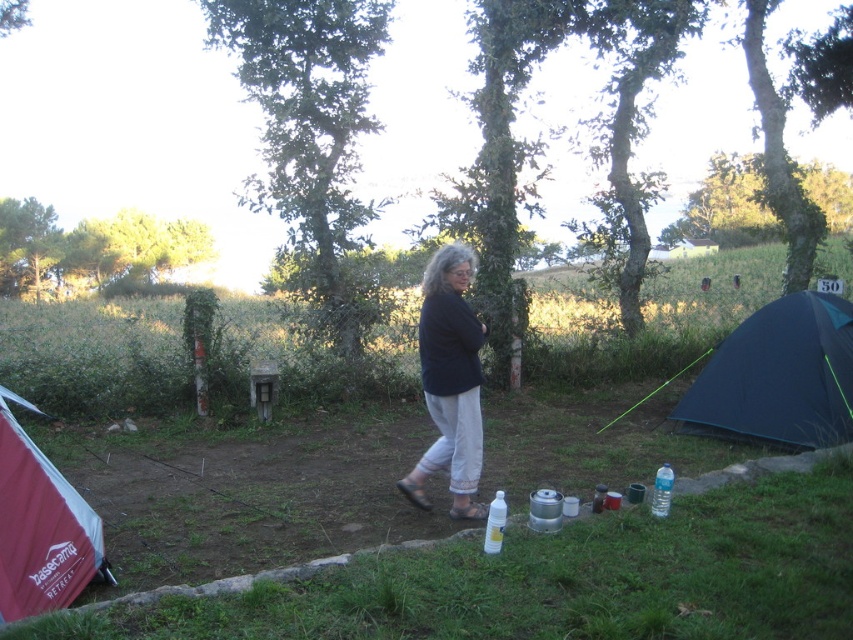
Can you confirm if dark blue fabric tent at right is smaller than black cotton shirt at center?

No.

Image resolution: width=853 pixels, height=640 pixels. In order to click on dark blue fabric tent at right in this screenshot , I will do `click(778, 376)`.

Identify the location of dark blue fabric tent at right. The height and width of the screenshot is (640, 853). point(778,376).

This screenshot has width=853, height=640. Find the location of `black cotton shirt at center`. black cotton shirt at center is located at coordinates (450, 381).

Is black cotton shirt at center thinner than clear plastic bottle at lower center?

No.

The width and height of the screenshot is (853, 640). Identify the location of black cotton shirt at center. (450, 381).

Find the location of a particular element. This screenshot has width=853, height=640. black cotton shirt at center is located at coordinates (450, 381).

Is red fabric tent at lower left smaller than transparent plastic bottle at lower center?

Actually, red fabric tent at lower left might be larger than transparent plastic bottle at lower center.

From the picture: Between red fabric tent at lower left and transparent plastic bottle at lower center, which one appears on the right side from the viewer's perspective?

Positioned to the right is transparent plastic bottle at lower center.

Between point (62, 566) and point (496, 500), which one is positioned behind?

The point (496, 500) is behind.

Find the location of a particular element. red fabric tent at lower left is located at coordinates (39, 525).